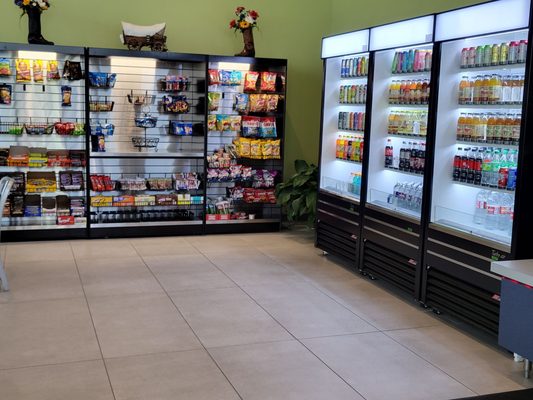
Locate an element on the screen. walls is located at coordinates (298, 23), (362, 22).